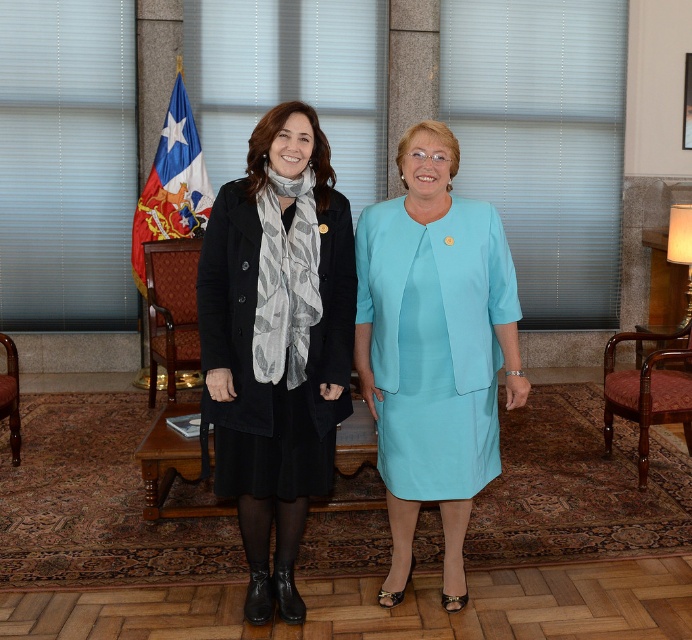
How distant is black matte coat at center from mahogany wood armchair at left?

They are 7.87 feet apart.

Between black matte coat at center and mahogany wood armchair at left, which one is positioned higher?

mahogany wood armchair at left is above.

Identify the location of black matte coat at center. (275, 340).

Who is higher up, light blue fabric dress at center or wooden armchair at left?

light blue fabric dress at center

Which is more to the right, light blue fabric dress at center or wooden armchair at left?

Positioned to the right is light blue fabric dress at center.

You are a GUI agent. You are given a task and a screenshot of the screen. Output one action in this format:
    pyautogui.click(x=<x>, y=<y>)
    Task: Click on the light blue fabric dress at center
    The height and width of the screenshot is (640, 692).
    Given the screenshot: What is the action you would take?
    pyautogui.click(x=435, y=342)

Who is lower down, black matte coat at center or blue fabric flag at left?

black matte coat at center is lower down.

Is point (282, 216) closer to viewer compared to point (173, 234)?

Yes, it is in front of point (173, 234).

Image resolution: width=692 pixels, height=640 pixels. I want to click on black matte coat at center, so click(x=275, y=340).